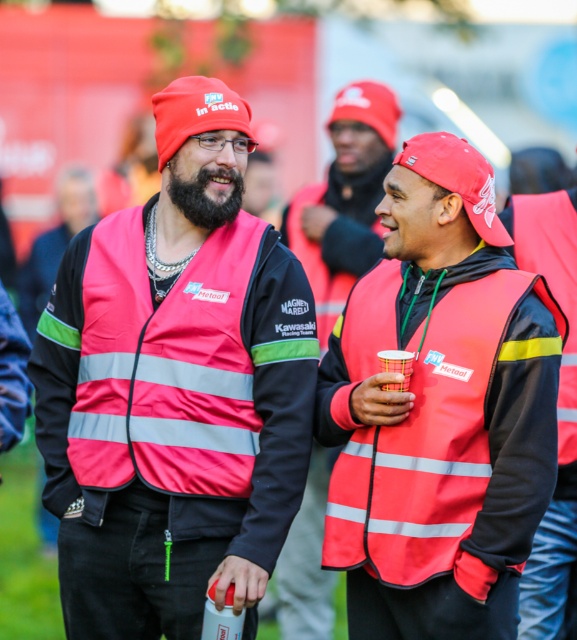
You are a photographer trying to capture both the matte pink vest at center and the reflective fabric life jacket at center in a single frame. Based on their positions, which object should you focus on first to ensure both are in the frame?

The matte pink vest at center is wider than the reflective fabric life jacket at center, so focusing on the matte pink vest at center first will help ensure both are in the frame.